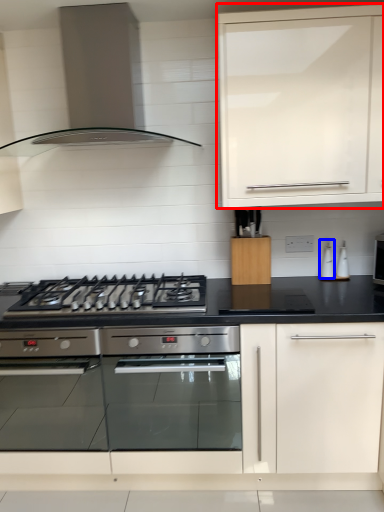
Question: Among these objects, which one is nearest to the camera, cabinetry (highlighted by a red box) or appliance (highlighted by a blue box)?

Choices:
 (A) cabinetry
 (B) appliance

Answer: (A)